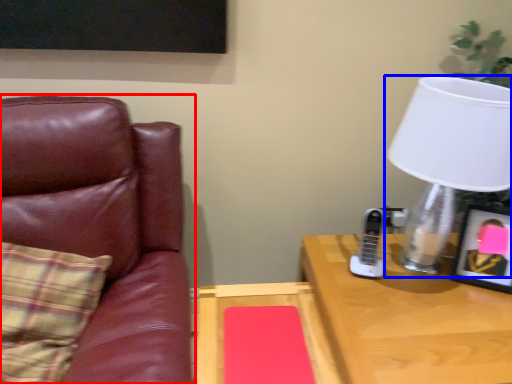
Question: Which of the following is the closest to the observer, chair (highlighted by a red box) or lamp (highlighted by a blue box)?

Choices:
 (A) chair
 (B) lamp

Answer: (A)